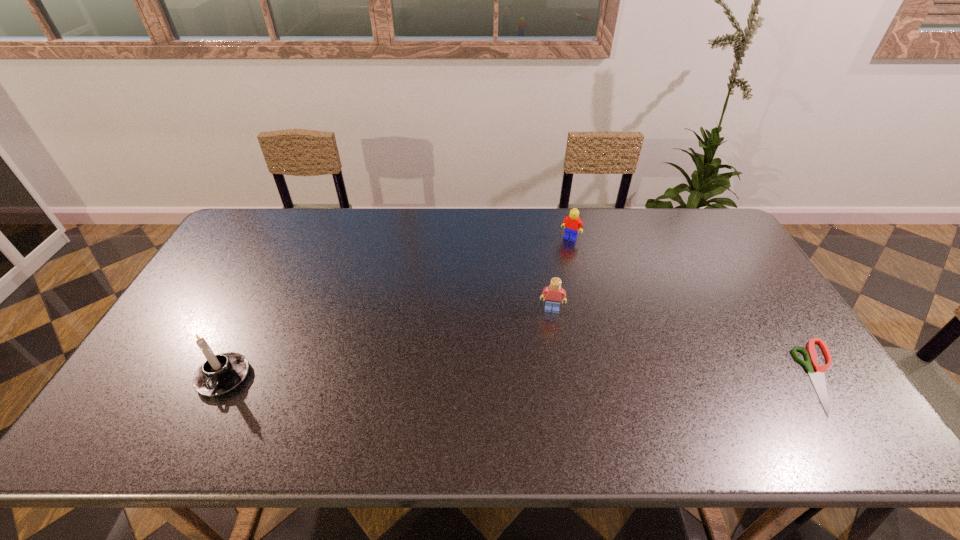
At what (x,y) coordinates should I click in order to perform the action: click on free space on the desktop that is between the leftmost object and the scissors and is positioned on the front-facing side of the third object from right to left. Please return your answer as a coordinate pair (x, y). The width and height of the screenshot is (960, 540). Looking at the image, I should click on (545, 376).

At what (x,y) coordinates should I click in order to perform the action: click on free spot on the desktop that is between the leftmost object and the rightmost object and is positioned on the front-facing side of the farthest object. Please return your answer as a coordinate pair (x, y). Looking at the image, I should click on (485, 376).